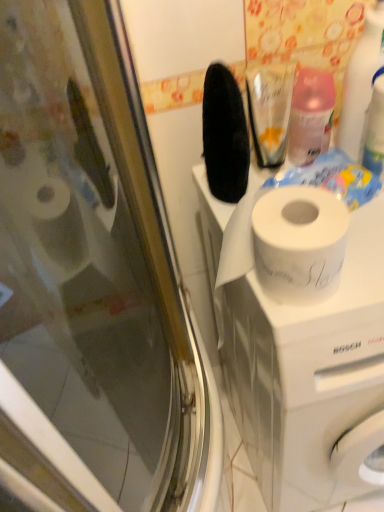
Question: Looking at the image, does white matte washing machine at upper center seem bigger or smaller compared to translucent plastic spray bottle at upper right, marked as the second cleaning product in a right-to-left arrangement?

Choices:
 (A) small
 (B) big

Answer: (B)

Question: Do you think white matte washing machine at upper center is within translucent plastic spray bottle at upper right, marked as the second cleaning product in a right-to-left arrangement, or outside of it?

Choices:
 (A) outside
 (B) inside

Answer: (A)

Question: Which is farther from the white matte washing machine at upper center?

Choices:
 (A) white glossy spray bottle at upper right, positioned as the 1th cleaning product in right-to-left order
 (B) translucent plastic spray bottle at upper right, marked as the second cleaning product in a right-to-left arrangement

Answer: (A)

Question: Estimate the real-world distances between objects in this image. Which object is farther from the white glossy spray bottle at upper right, the second cleaning product positioned from the left?

Choices:
 (A) white matte washing machine at upper center
 (B) translucent plastic spray bottle at upper right, acting as the 1th cleaning product starting from the left

Answer: (A)